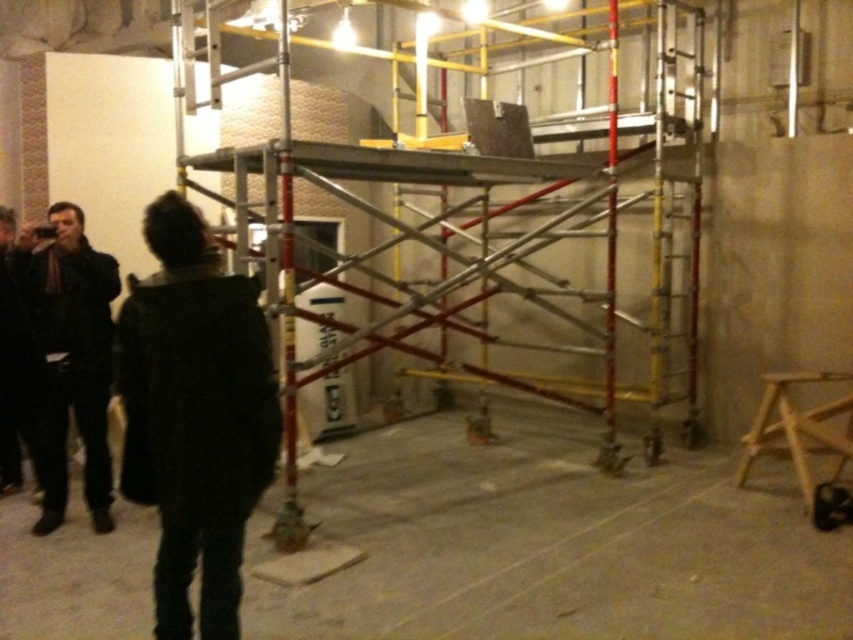
Does concrete floor at center have a greater width compared to dark brown leather jacket at left?

Indeed, concrete floor at center has a greater width compared to dark brown leather jacket at left.

Is point (84, 612) farther from camera compared to point (67, 250)?

No, (84, 612) is closer to viewer.

Find the location of `concrete floor at center`. concrete floor at center is located at coordinates (550, 545).

Is point (306, 614) in front of point (175, 461)?

No, it is not.

Is concrete floor at center wider than dark green jacket at left?

Yes.

Image resolution: width=853 pixels, height=640 pixels. What do you see at coordinates (550, 545) in the screenshot?
I see `concrete floor at center` at bounding box center [550, 545].

The width and height of the screenshot is (853, 640). I want to click on concrete floor at center, so pos(550,545).

This screenshot has height=640, width=853. Identify the location of dark green jacket at left. (x=196, y=413).

I want to click on dark green jacket at left, so [196, 413].